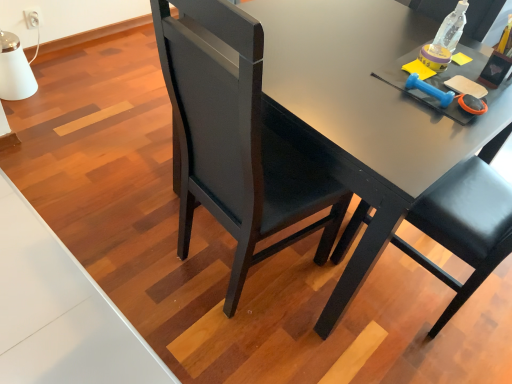
Question: Can you confirm if black leather chair at center is bigger than matte black desk at center?

Choices:
 (A) yes
 (B) no

Answer: (B)

Question: From a real-world perspective, is black leather chair at center over matte black desk at center?

Choices:
 (A) yes
 (B) no

Answer: (A)

Question: Considering the relative positions of black leather chair at center and matte black desk at center in the image provided, is black leather chair at center to the left of matte black desk at center from the viewer's perspective?

Choices:
 (A) no
 (B) yes

Answer: (B)

Question: From the image's perspective, is black leather chair at center beneath matte black desk at center?

Choices:
 (A) yes
 (B) no

Answer: (A)

Question: Are black leather chair at center and matte black desk at center making contact?

Choices:
 (A) no
 (B) yes

Answer: (A)

Question: Is matte black desk at center surrounded by black leather chair at center?

Choices:
 (A) yes
 (B) no

Answer: (B)

Question: From the image's perspective, is black leather chair at center over clear plastic bottle at upper right?

Choices:
 (A) yes
 (B) no

Answer: (B)

Question: Does black leather chair at center have a greater height compared to clear plastic bottle at upper right?

Choices:
 (A) no
 (B) yes

Answer: (B)

Question: Could you tell me if black leather chair at center is turned towards clear plastic bottle at upper right?

Choices:
 (A) yes
 (B) no

Answer: (A)

Question: Considering the relative positions of black leather chair at center and clear plastic bottle at upper right in the image provided, is black leather chair at center to the left of clear plastic bottle at upper right from the viewer's perspective?

Choices:
 (A) yes
 (B) no

Answer: (A)

Question: Is the position of black leather chair at center more distant than that of clear plastic bottle at upper right?

Choices:
 (A) no
 (B) yes

Answer: (A)

Question: Is black leather chair at center at the right side of clear plastic bottle at upper right?

Choices:
 (A) no
 (B) yes

Answer: (A)

Question: From the image's perspective, is clear plastic bottle at upper right above matte black desk at center?

Choices:
 (A) yes
 (B) no

Answer: (A)